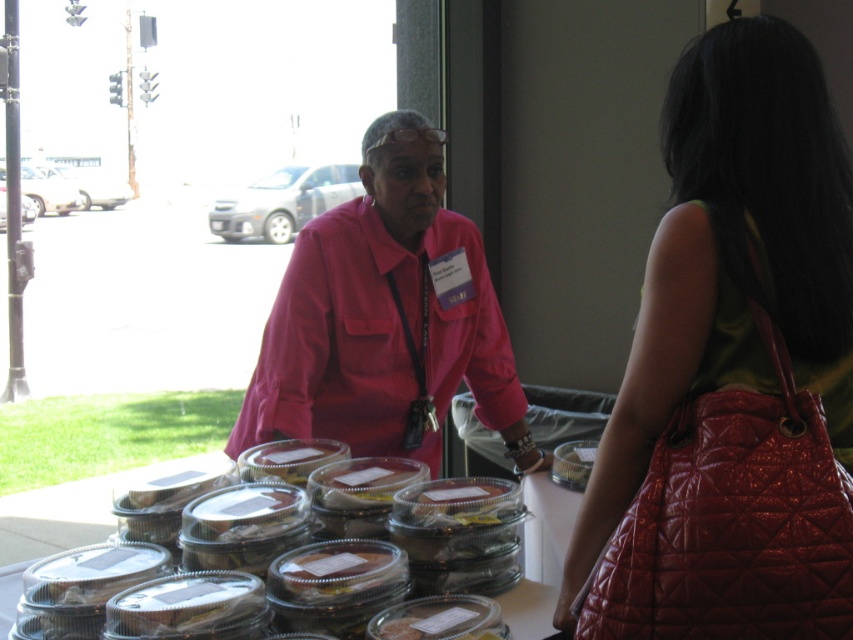
Question: Is shiny red purse at center further to camera compared to pink fabric shirt at center?

Choices:
 (A) yes
 (B) no

Answer: (B)

Question: Which point is closer to the camera?

Choices:
 (A) shiny red purse at center
 (B) pink fabric shirt at center

Answer: (A)

Question: Does shiny red purse at center appear on the left side of pink fabric shirt at center?

Choices:
 (A) yes
 (B) no

Answer: (B)

Question: Which object appears closest to the camera in this image?

Choices:
 (A) shiny red purse at center
 (B) pink fabric shirt at center

Answer: (A)

Question: Which point is closer to the camera taking this photo?

Choices:
 (A) (421, 374)
 (B) (738, 467)

Answer: (B)

Question: Observing the image, what is the correct spatial positioning of shiny red purse at center in reference to pink fabric shirt at center?

Choices:
 (A) below
 (B) above

Answer: (A)